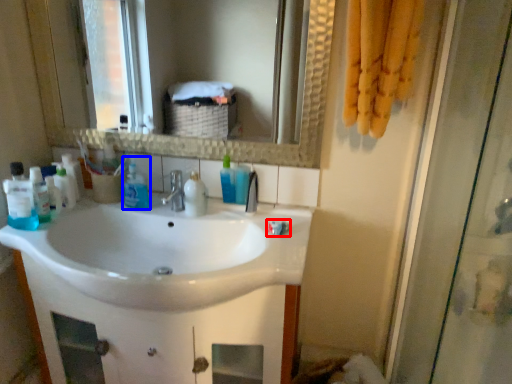
Question: Among these objects, which one is farthest to the camera, toothpaste (highlighted by a red box) or cleaning product (highlighted by a blue box)?

Choices:
 (A) toothpaste
 (B) cleaning product

Answer: (B)